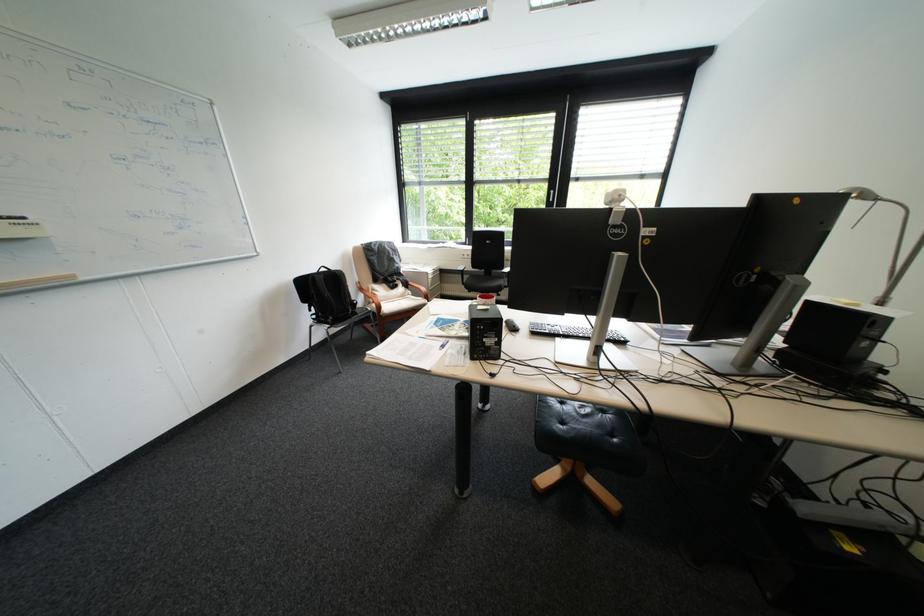
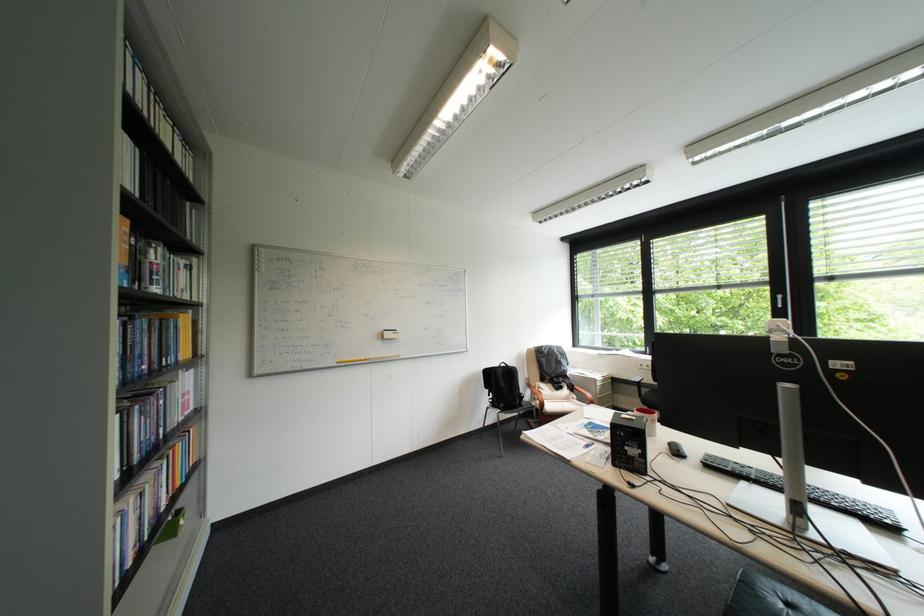
Find the pixel in the second image that matches point (365, 300) in the first image.

(533, 392)